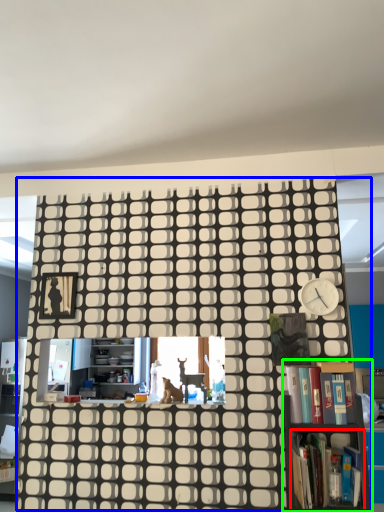
Question: Which is nearer to the book (highlighted by a red box)? bookcase (highlighted by a blue box) or bookcase (highlighted by a green box).

Choices:
 (A) bookcase
 (B) bookcase

Answer: (B)